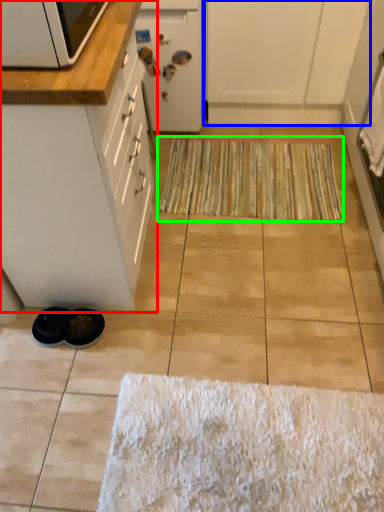
Question: Based on their relative distances, which object is farther from cabinetry (highlighted by a red box)? Choose from cabinetry (highlighted by a blue box) and doormat (highlighted by a green box).

Choices:
 (A) cabinetry
 (B) doormat

Answer: (A)